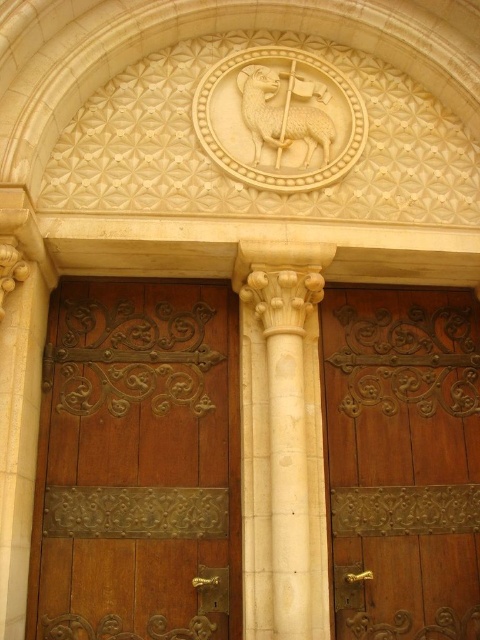
Question: Is brown wood door at center thinner than white stone column at center?

Choices:
 (A) yes
 (B) no

Answer: (A)

Question: Considering the real-world distances, which object is closest to the wooden door at center?

Choices:
 (A) white stone column at center
 (B) brown wood door at center

Answer: (A)

Question: Which object appears farthest from the camera in this image?

Choices:
 (A) white stone column at center
 (B) wooden door at center
 (C) brown wood door at center

Answer: (C)

Question: Is wooden door at center below brown wood door at center?

Choices:
 (A) yes
 (B) no

Answer: (A)

Question: Is wooden door at center closer to camera compared to brown wood door at center?

Choices:
 (A) yes
 (B) no

Answer: (A)

Question: Considering the real-world distances, which object is closest to the white stone column at center?

Choices:
 (A) brown wood door at center
 (B) wooden door at center

Answer: (A)